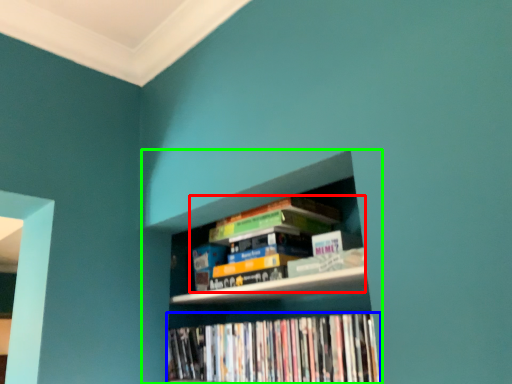
Question: Estimate the real-world distances between objects in this image. Which object is closer to book (highlighted by a red box), book (highlighted by a blue box) or bookcase (highlighted by a green box)?

Choices:
 (A) book
 (B) bookcase

Answer: (B)